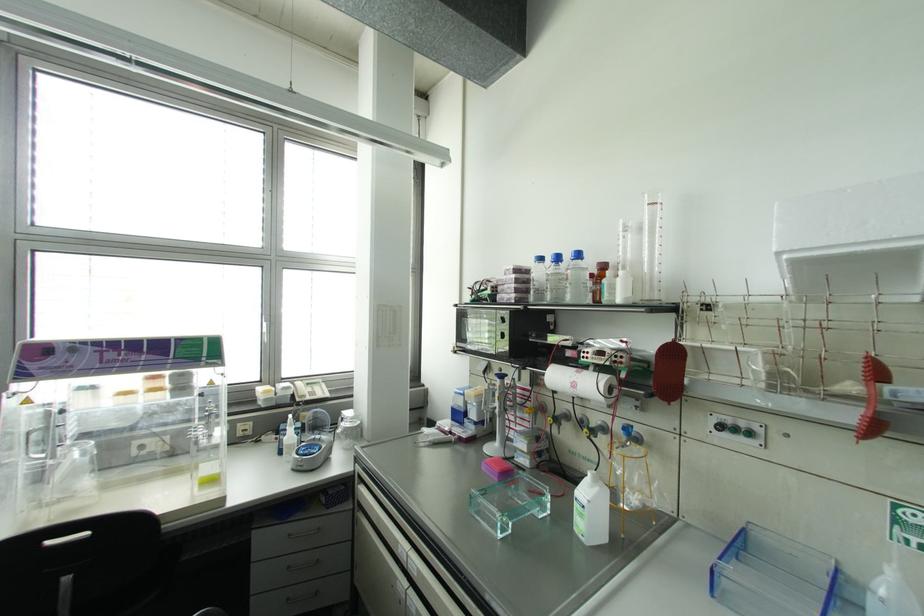
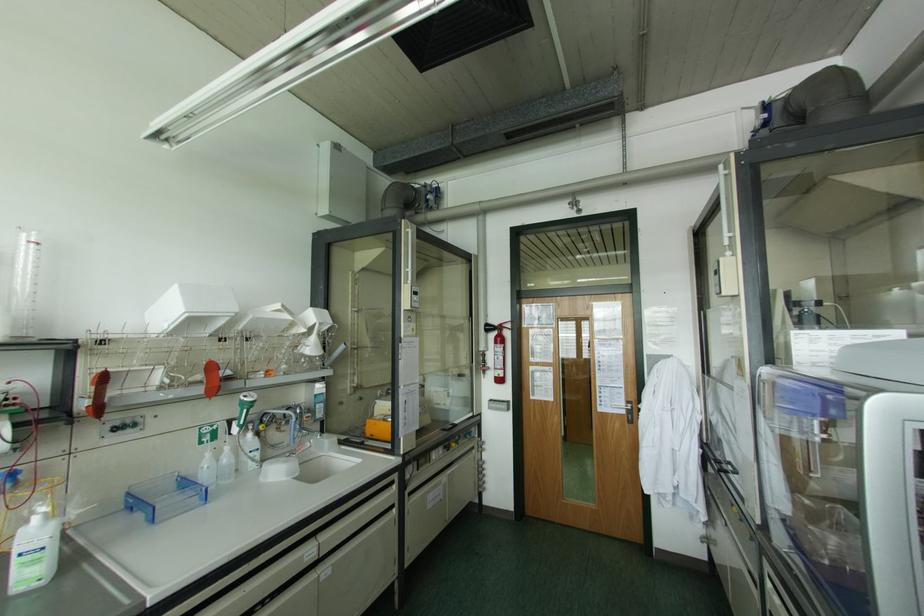
Where in the second image is the point corresponding to point (721, 427) from the first image?

(115, 428)